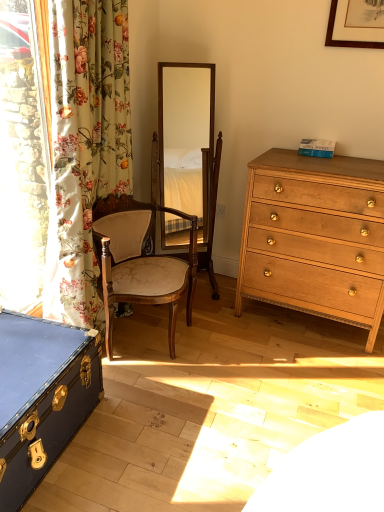
What is the approximate height of wooden upholstered chair at center?

It is 28.25 inches.

This screenshot has height=512, width=384. What do you see at coordinates (210, 215) in the screenshot? I see `wooden swivel chair at center` at bounding box center [210, 215].

Where is `white plastic power outlet at center`? The image size is (384, 512). white plastic power outlet at center is located at coordinates (220, 210).

Is floral fabric curtain at left not near light brown wooden chest of drawers at right?

No.

From the image's perspective, is floral fabric curtain at left above or below light brown wooden chest of drawers at right?

From the image's perspective, floral fabric curtain at left appears above light brown wooden chest of drawers at right.

Can we say floral fabric curtain at left lies outside light brown wooden chest of drawers at right?

Yes, floral fabric curtain at left is located beyond the bounds of light brown wooden chest of drawers at right.

Is floral fabric curtain at left facing away from light brown wooden chest of drawers at right?

No, light brown wooden chest of drawers at right is not at the back of floral fabric curtain at left.

Considering the positions of points (217, 215) and (80, 267), is point (217, 215) farther from camera compared to point (80, 267)?

Yes.

Which object is closer to the camera, white plastic power outlet at center or floral fabric curtain at left?

floral fabric curtain at left.

Is white plastic power outlet at center oriented towards floral fabric curtain at left?

Yes, white plastic power outlet at center faces towards floral fabric curtain at left.

From a real-world perspective, which object stands above the other?

floral fabric curtain at left, from a real-world perspective.

Can you confirm if wooden swivel chair at center is smaller than white plastic power outlet at center?

Actually, wooden swivel chair at center might be larger than white plastic power outlet at center.

Where is `swivel chair lying in front of the white plastic power outlet at center`? Image resolution: width=384 pixels, height=512 pixels. swivel chair lying in front of the white plastic power outlet at center is located at coordinates (210, 215).

From a real-world perspective, is wooden swivel chair at center located higher than white plastic power outlet at center?

Correct, in the physical world, wooden swivel chair at center is higher than white plastic power outlet at center.

From a real-world perspective, is white plastic power outlet at center on light brown wooden chest of drawers at right?

No, from a real-world perspective, white plastic power outlet at center is not over light brown wooden chest of drawers at right

Is white plastic power outlet at center thinner than light brown wooden chest of drawers at right?

Yes.

Does white plastic power outlet at center have a lesser height compared to light brown wooden chest of drawers at right?

Correct, white plastic power outlet at center is not as tall as light brown wooden chest of drawers at right.

Considering the positions of point (219, 212) and point (376, 228), is point (219, 212) closer or farther from the camera than point (376, 228)?

Point (219, 212).

From the image's perspective, between wooden upholstered chair at center and light brown wooden chest of drawers at right, which one is located above?

light brown wooden chest of drawers at right, from the image's perspective.

Is wooden upholstered chair at center in front of or behind light brown wooden chest of drawers at right in the image?

In the image, wooden upholstered chair at center appears in front of light brown wooden chest of drawers at right.

From their relative heights in the image, would you say wooden upholstered chair at center is taller or shorter than light brown wooden chest of drawers at right?

Clearly, wooden upholstered chair at center is shorter compared to light brown wooden chest of drawers at right.

Is wooden upholstered chair at center spatially inside light brown wooden chest of drawers at right, or outside of it?

The correct answer is: outside.

Between floral fabric curtain at left and blue leather trunk at lower left, which one appears on the right side from the viewer's perspective?

floral fabric curtain at left is more to the right.

Are floral fabric curtain at left and blue leather trunk at lower left far apart?

No.

Is point (94, 324) positioned before point (70, 433)?

No, it is not.

Can you tell me how much blue leather trunk at lower left and floral fabric curtain at left differ in facing direction?

blue leather trunk at lower left and floral fabric curtain at left are facing 0.732 degrees away from each other.

Is floral fabric curtain at left at the back of blue leather trunk at lower left?

No, floral fabric curtain at left is not at the back of blue leather trunk at lower left.

Are blue leather trunk at lower left and floral fabric curtain at left far apart?

blue leather trunk at lower left is near floral fabric curtain at left, not far away.

From the picture: Between blue leather trunk at lower left and floral fabric curtain at left, which one has more height?

With more height is floral fabric curtain at left.

At what (x,y) coordinates should I click in order to perform the action: click on chest of drawers below the floral fabric curtain at left (from a real-world perspective). Please return your answer as a coordinate pair (x, y). The width and height of the screenshot is (384, 512). Looking at the image, I should click on (315, 237).

The height and width of the screenshot is (512, 384). What are the coordinates of `power outlet that is on the right side of floral fabric curtain at left` in the screenshot? It's located at (220, 210).

Estimate the real-world distances between objects in this image. Which object is closer to white plastic power outlet at center, floral fabric curtain at left or light brown wooden chest of drawers at right?

Among the two, light brown wooden chest of drawers at right is located nearer to white plastic power outlet at center.

When comparing their distances from light brown wooden chest of drawers at right, does white plastic power outlet at center or wooden swivel chair at center seem further?

white plastic power outlet at center is further to light brown wooden chest of drawers at right.

From the image, which object appears to be farther from blue leather trunk at lower left, floral fabric curtain at left or wooden upholstered chair at center?

Based on the image, floral fabric curtain at left appears to be further to blue leather trunk at lower left.

From the picture: When comparing their distances from white plastic power outlet at center, does light brown wooden chest of drawers at right or blue leather trunk at lower left seem further?

blue leather trunk at lower left.

When comparing their distances from wooden swivel chair at center, does floral fabric curtain at left or wooden upholstered chair at center seem closer?

The object closer to wooden swivel chair at center is wooden upholstered chair at center.

Considering their positions, is floral fabric curtain at left positioned closer to white plastic power outlet at center than blue leather trunk at lower left?

Based on the image, floral fabric curtain at left appears to be nearer to white plastic power outlet at center.

When comparing their distances from white plastic power outlet at center, does wooden upholstered chair at center or blue leather trunk at lower left seem further?

blue leather trunk at lower left is positioned further to the anchor white plastic power outlet at center.

When comparing their distances from wooden swivel chair at center, does light brown wooden chest of drawers at right or wooden upholstered chair at center seem further?

Among the two, light brown wooden chest of drawers at right is located further to wooden swivel chair at center.

You are a GUI agent. You are given a task and a screenshot of the screen. Output one action in this format:
    pyautogui.click(x=<x>, y=<y>)
    Task: Click on the swivel chair situated between blue leather trunk at lower left and light brown wooden chest of drawers at right from left to right
    
    Given the screenshot: What is the action you would take?
    pyautogui.click(x=210, y=215)

Where is `swivel chair located between floral fabric curtain at left and white plastic power outlet at center in the depth direction`? swivel chair located between floral fabric curtain at left and white plastic power outlet at center in the depth direction is located at coordinates (210, 215).

The height and width of the screenshot is (512, 384). Find the location of `chair between floral fabric curtain at left and light brown wooden chest of drawers at right from left to right`. chair between floral fabric curtain at left and light brown wooden chest of drawers at right from left to right is located at coordinates (140, 262).

Identify the location of chest of drawers between wooden upholstered chair at center and white plastic power outlet at center in the front-back direction. pyautogui.click(x=315, y=237).